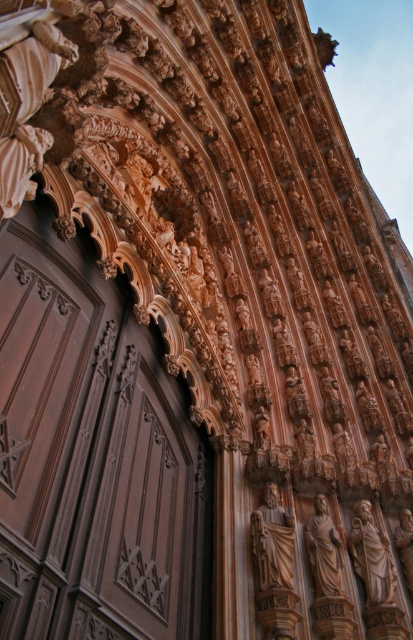
You are standing in front of the cathedral facade and notice two points marked on the structure. The first point is at coordinates point (277, 497) and the second is at point (408, 528). Which of these points is closer to you?

Point (277, 497) is in front of point (408, 528), so it is closer to you.

You are an art conservator examining the facade of a cathedral. You notice two statues at the center of the upper facade. Which statue is closer to you, the polished brown statue at center or the polished bronze statue at center?

The polished brown statue at center is closer to you because it is in front of the polished bronze statue at center.